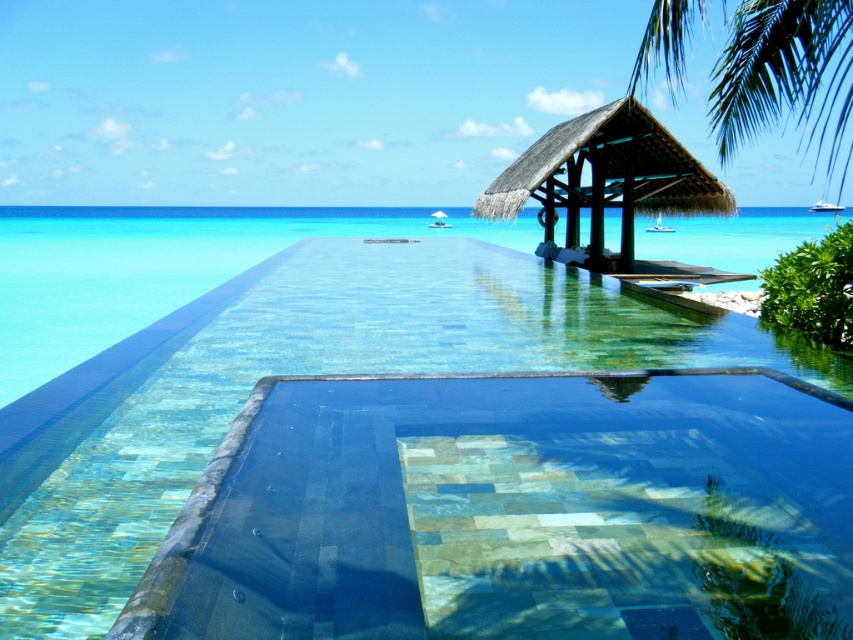
Question: Among these objects, which one is farthest from the camera?

Choices:
 (A) clear glass water at center
 (B) green leafy palm tree at upper right
 (C) thatched roof gazebo at upper right
 (D) translucent mosaic pool at center

Answer: (C)

Question: Is translucent mosaic pool at center above clear glass water at center?

Choices:
 (A) no
 (B) yes

Answer: (A)

Question: Estimate the real-world distances between objects in this image. Which object is closer to the thatched roof gazebo at upper right?

Choices:
 (A) green leafy palm tree at upper right
 (B) clear glass water at center
 (C) translucent mosaic pool at center

Answer: (A)

Question: Which of the following is the farthest from the observer?

Choices:
 (A) (544, 179)
 (B) (798, 236)

Answer: (B)

Question: From the image, what is the correct spatial relationship of translucent mosaic pool at center in relation to green leafy palm tree at upper right?

Choices:
 (A) above
 (B) below

Answer: (B)

Question: Does translucent mosaic pool at center appear under thatched roof gazebo at upper right?

Choices:
 (A) no
 (B) yes

Answer: (B)